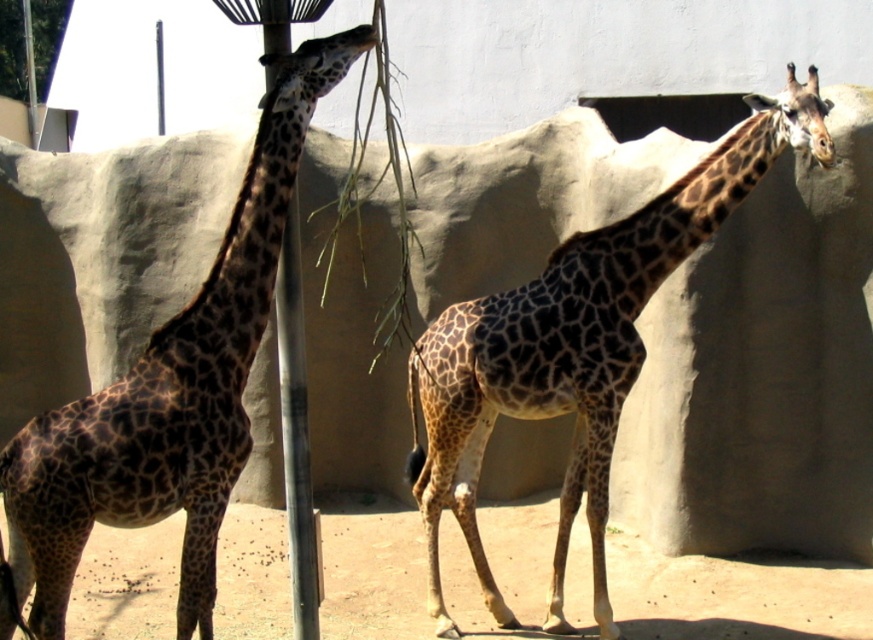
You are a zookeeper standing at the camera position. You need to feed the spotted fur giraffe at left. The feeding tool you have can reach up to 10 feet. Can you reach the giraffe with your tool?

The spotted fur giraffe at left and camera are 12.95 feet apart from each other. Since the feeding tool can only reach up to 10 feet, you cannot reach the giraffe with your tool.

You are a zookeeper trying to determine the best spot to place a new feeding station. You have two points marked on the enclosure wall at coordinates point (49, 589) and point (601, 483). Which point is closer to the camera and thus more visible to the giraffes?

Point (49, 589) is closer to the camera than point (601, 483), so it is more visible to the giraffes.

You are a zookeeper observing two spotted fur giraffes in an enclosure. You notice the spotted fur giraffe at left and the spotted fur giraffe at center. Which giraffe is positioned more to the left?

The spotted fur giraffe at left is positioned more to the left than the spotted fur giraffe at center because it is on the left side of the other giraffe.